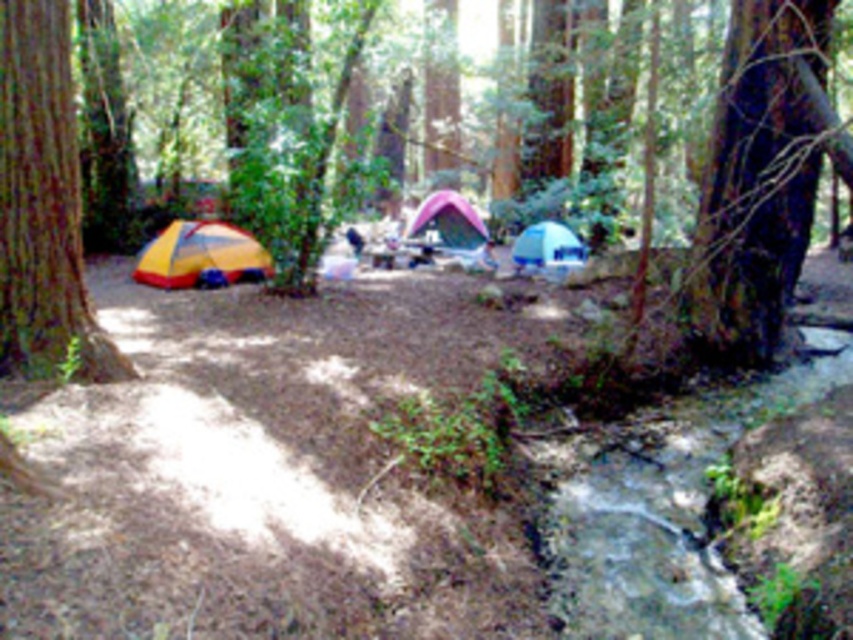
Question: Considering the relative positions of brown rough bark tree at center right and brown rough tree trunk at left in the image provided, where is brown rough bark tree at center right located with respect to brown rough tree trunk at left?

Choices:
 (A) below
 (B) above

Answer: (B)

Question: Which point is closer to the camera?

Choices:
 (A) brown rough bark tree at center right
 (B) brown rough tree trunk at left
 (C) blue tarpaulin tent at center

Answer: (B)

Question: Which object is the closest to the brown rough bark tree at center right?

Choices:
 (A) pink fabric tent at center
 (B) brown rough tree trunk at left
 (C) blue tarpaulin tent at center
 (D) yellow/red fabric tent at left

Answer: (C)

Question: Can you confirm if brown rough bark tree at center right is wider than brown rough tree trunk at left?

Choices:
 (A) no
 (B) yes

Answer: (B)

Question: Can you confirm if yellow/red fabric tent at left is thinner than pink fabric tent at center?

Choices:
 (A) no
 (B) yes

Answer: (A)

Question: Which is farther from the yellow/red fabric tent at left?

Choices:
 (A) brown rough tree trunk at left
 (B) blue tarpaulin tent at center
 (C) brown rough bark tree at center right
 (D) pink fabric tent at center

Answer: (A)